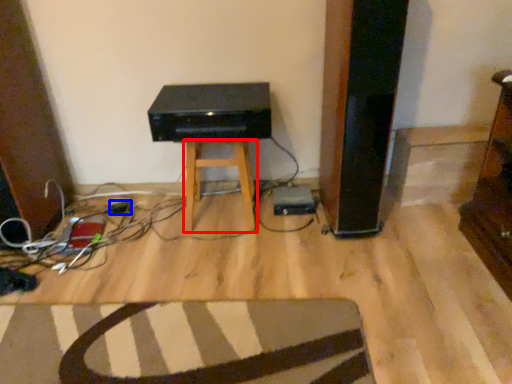
Question: Which object is further to the camera taking this photo, stool (highlighted by a red box) or plug (highlighted by a blue box)?

Choices:
 (A) stool
 (B) plug

Answer: (B)